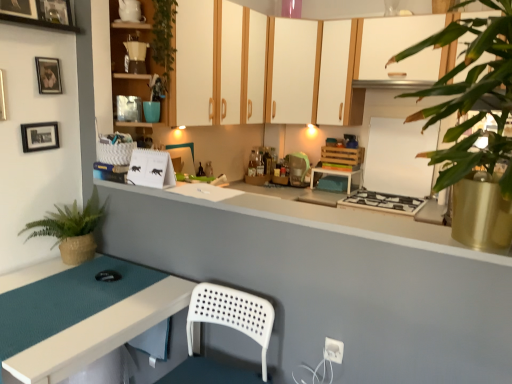
Find the location of `vacant space to the right of braided straw pot at left, which is the 1th houseplant in back-to-front order`. vacant space to the right of braided straw pot at left, which is the 1th houseplant in back-to-front order is located at coordinates (117, 269).